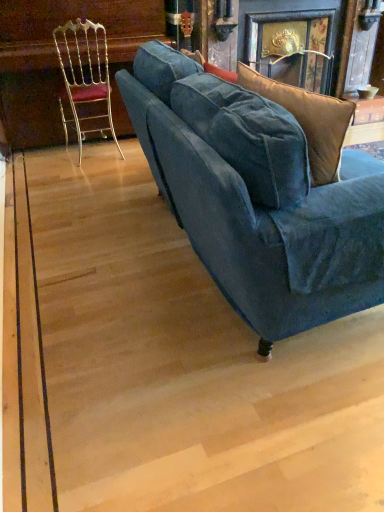
Question: Is gold metallic chair at left taller than velvet blue couch at center?

Choices:
 (A) no
 (B) yes

Answer: (B)

Question: Considering the relative positions of gold metallic chair at left and velvet blue couch at center in the image provided, is gold metallic chair at left to the left of velvet blue couch at center from the viewer's perspective?

Choices:
 (A) yes
 (B) no

Answer: (A)

Question: Is the surface of gold metallic chair at left in direct contact with velvet blue couch at center?

Choices:
 (A) yes
 (B) no

Answer: (B)

Question: Is gold metallic chair at left positioned beyond the bounds of velvet blue couch at center?

Choices:
 (A) no
 (B) yes

Answer: (B)

Question: Does gold metallic chair at left have a smaller size compared to velvet blue couch at center?

Choices:
 (A) no
 (B) yes

Answer: (B)

Question: Is gold metallic chair at left positioned with its back to velvet blue couch at center?

Choices:
 (A) no
 (B) yes

Answer: (B)

Question: Does wooden table at upper right touch gold metallic chair at left?

Choices:
 (A) no
 (B) yes

Answer: (A)

Question: Is wooden table at upper right completely or partially outside of gold metallic chair at left?

Choices:
 (A) yes
 (B) no

Answer: (A)

Question: Does wooden table at upper right have a greater height compared to gold metallic chair at left?

Choices:
 (A) yes
 (B) no

Answer: (B)

Question: Is wooden table at upper right far away from gold metallic chair at left?

Choices:
 (A) no
 (B) yes

Answer: (B)

Question: Is wooden table at upper right positioned with its back to gold metallic chair at left?

Choices:
 (A) yes
 (B) no

Answer: (B)

Question: From a real-world perspective, is wooden table at upper right located beneath gold metallic chair at left?

Choices:
 (A) no
 (B) yes

Answer: (B)

Question: Is wooden table at upper right turned away from velvet blue couch at center?

Choices:
 (A) no
 (B) yes

Answer: (A)